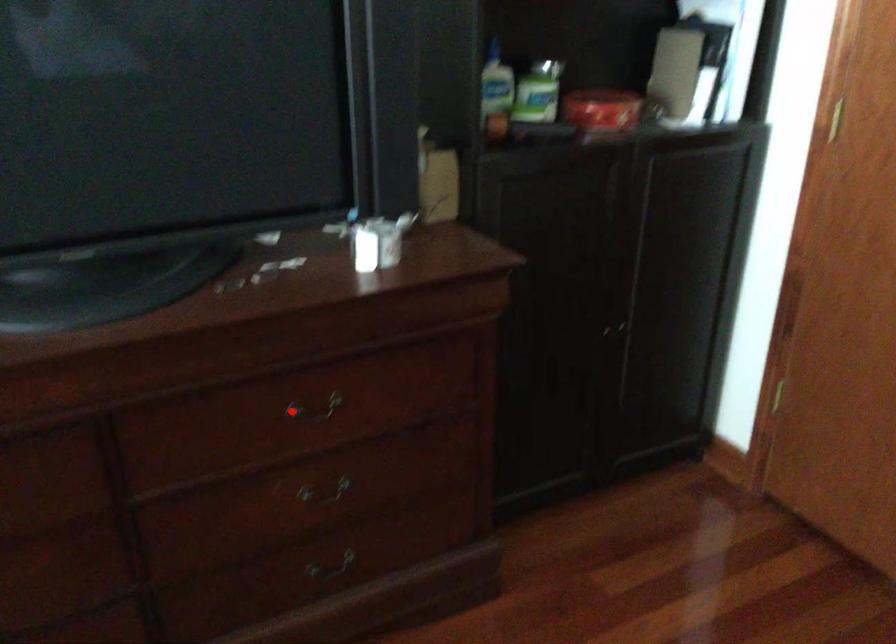
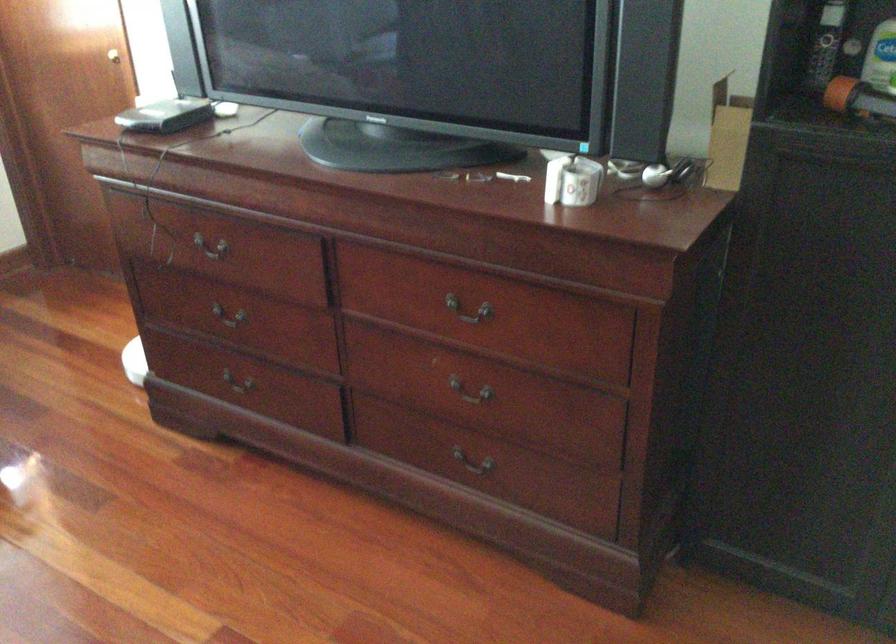
Where in the second image is the point corresponding to the highlighted location from the first image?

(469, 310)